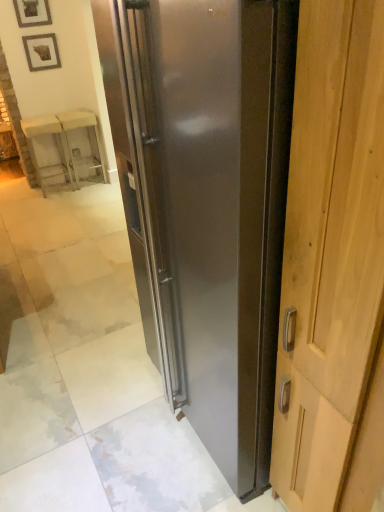
Question: Does wooden framed picture at upper left, the 2th picture frame ordered from the bottom, appear on the right side of wooden chair at left, the second furniture viewed from the right?

Choices:
 (A) no
 (B) yes

Answer: (B)

Question: Considering the relative positions of wooden framed picture at upper left, the 2th picture frame ordered from the bottom, and wooden chair at left, the second furniture viewed from the right, in the image provided, is wooden framed picture at upper left, the 2th picture frame ordered from the bottom, to the left of wooden chair at left, the second furniture viewed from the right, from the viewer's perspective?

Choices:
 (A) no
 (B) yes

Answer: (A)

Question: Is wooden framed picture at upper left, the 2th picture frame ordered from the bottom, further to the viewer compared to wooden chair at left, which is the 1th furniture from left to right?

Choices:
 (A) no
 (B) yes

Answer: (A)

Question: From the image's perspective, does wooden framed picture at upper left, the 2th picture frame ordered from the bottom, appear lower than wooden chair at left, which is the 1th furniture from left to right?

Choices:
 (A) no
 (B) yes

Answer: (A)

Question: Is wooden framed picture at upper left, the 2th picture frame ordered from the bottom, positioned in front of wooden chair at left, which is the 1th furniture from left to right?

Choices:
 (A) yes
 (B) no

Answer: (A)

Question: Would you say wooden picture frame at upper left, positioned as the 2th picture frame in top-to-bottom order, is inside or outside wooden framed picture at upper left, which appears as the first picture frame when viewed from the top?

Choices:
 (A) outside
 (B) inside

Answer: (A)

Question: From their relative heights in the image, would you say wooden picture frame at upper left, arranged as the first picture frame when ordered from the bottom, is taller or shorter than wooden framed picture at upper left, which appears as the first picture frame when viewed from the top?

Choices:
 (A) tall
 (B) short

Answer: (A)

Question: Is wooden picture frame at upper left, positioned as the 2th picture frame in top-to-bottom order, in front of or behind wooden framed picture at upper left, which appears as the first picture frame when viewed from the top, in the image?

Choices:
 (A) behind
 (B) front

Answer: (A)

Question: From the image's perspective, is wooden picture frame at upper left, positioned as the 2th picture frame in top-to-bottom order, above or below wooden framed picture at upper left, which appears as the first picture frame when viewed from the top?

Choices:
 (A) above
 (B) below

Answer: (B)

Question: Considering the relative positions of wooden framed picture at upper left, which appears as the first picture frame when viewed from the top, and wooden picture frame at upper left, positioned as the 2th picture frame in top-to-bottom order, in the image provided, is wooden framed picture at upper left, which appears as the first picture frame when viewed from the top, to the left or to the right of wooden picture frame at upper left, positioned as the 2th picture frame in top-to-bottom order,?

Choices:
 (A) right
 (B) left

Answer: (B)

Question: Is wooden framed picture at upper left, the 2th picture frame ordered from the bottom, wider or thinner than wooden picture frame at upper left, arranged as the first picture frame when ordered from the bottom?

Choices:
 (A) thin
 (B) wide

Answer: (A)

Question: Relative to wooden picture frame at upper left, positioned as the 2th picture frame in top-to-bottom order, is wooden framed picture at upper left, which appears as the first picture frame when viewed from the top, in front or behind?

Choices:
 (A) front
 (B) behind

Answer: (A)

Question: Considering the positions of wooden framed picture at upper left, which appears as the first picture frame when viewed from the top, and wooden picture frame at upper left, arranged as the first picture frame when ordered from the bottom, in the image, is wooden framed picture at upper left, which appears as the first picture frame when viewed from the top, bigger or smaller than wooden picture frame at upper left, arranged as the first picture frame when ordered from the bottom,?

Choices:
 (A) big
 (B) small

Answer: (B)

Question: From the image's perspective, is translucent glass cabinet at upper left, the 2th furniture viewed from the left, above or below stainless steel refrigerator at center?

Choices:
 (A) below
 (B) above

Answer: (B)

Question: Considering the positions of point (66, 143) and point (150, 249), is point (66, 143) closer or farther from the camera than point (150, 249)?

Choices:
 (A) closer
 (B) farther

Answer: (B)